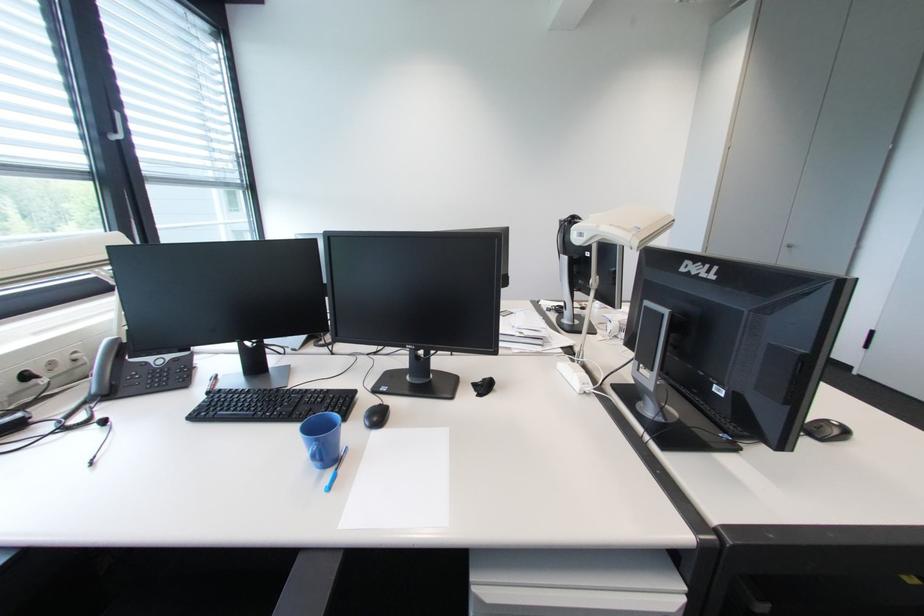
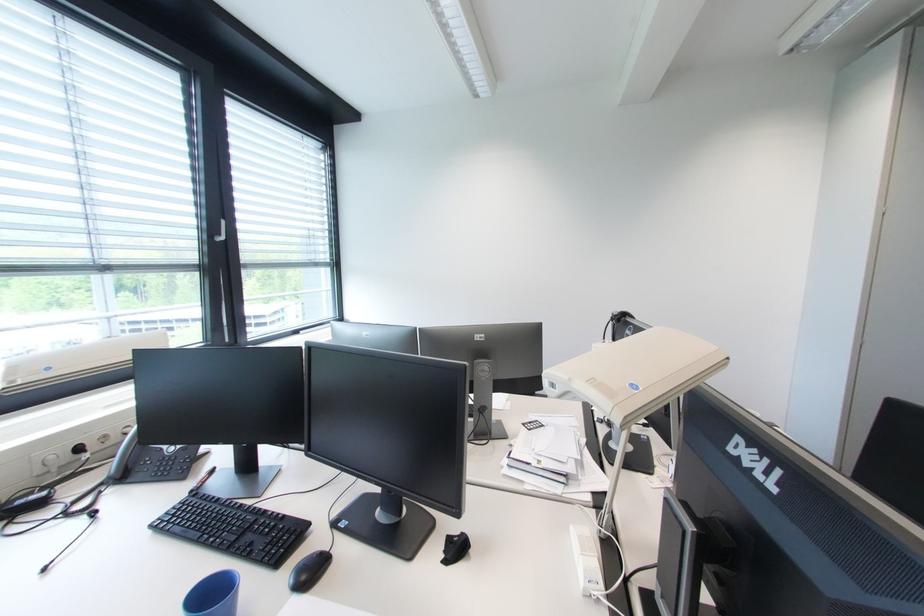
Question: The camera is either moving clockwise (left) or counter-clockwise (right) around the object. The first image is from the beginning of the video and the second image is from the end. Is the camera moving left or right when shooting the video?

Choices:
 (A) Left
 (B) Right

Answer: (B)